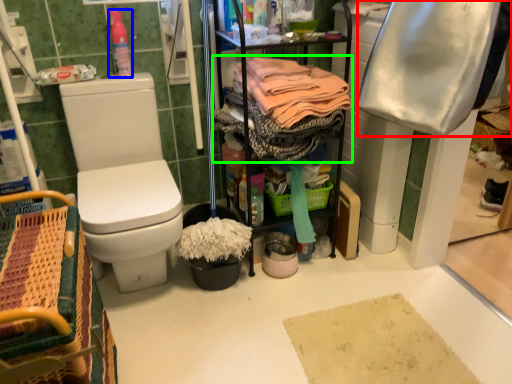
Question: Based on their relative distances, which object is farther from clothing (highlighted by a red box)? Choose from cleaning products (highlighted by a blue box) and clothing (highlighted by a green box).

Choices:
 (A) cleaning products
 (B) clothing

Answer: (A)